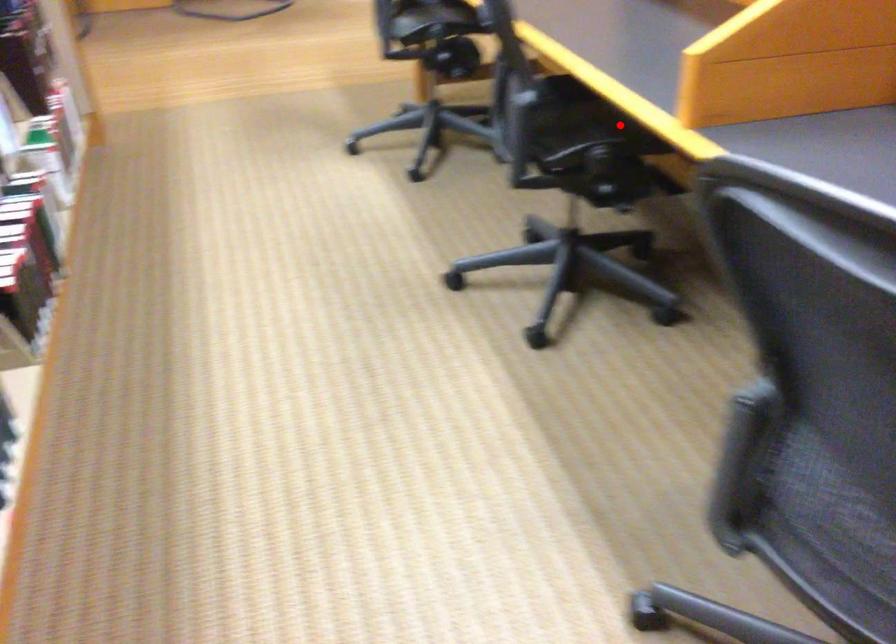
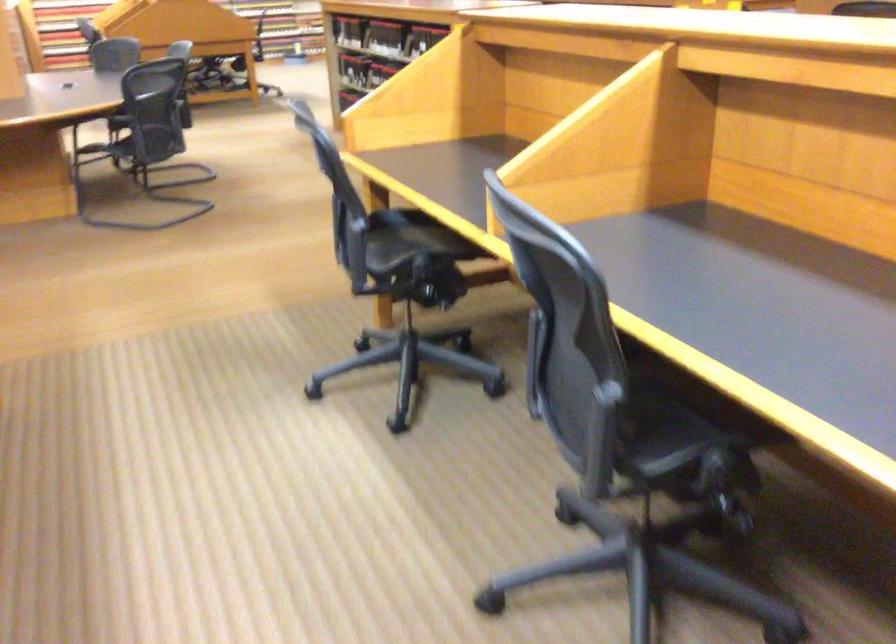
Question: I am providing you with two images of the same scene from different viewpoints. Image1 has a red point marked. In image2, the corresponding 3D location appears at what relative position? Reply with the corresponding letter.

Choices:
 (A) Closer
 (B) Farther

Answer: (A)